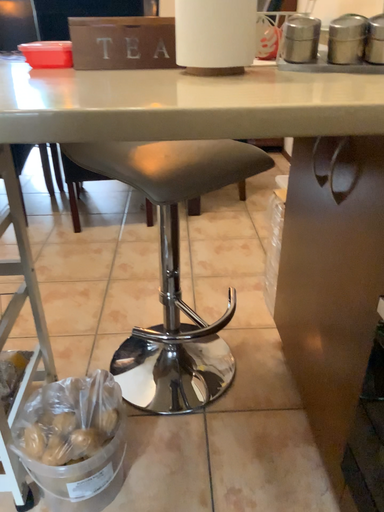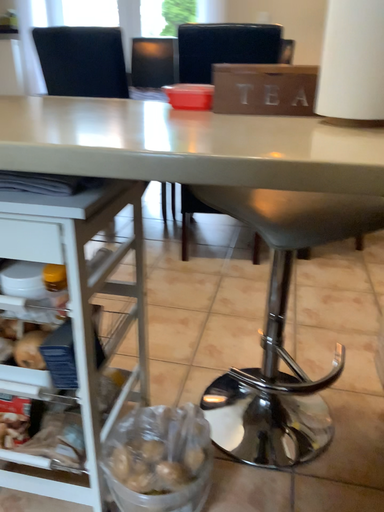
Question: How did the camera likely rotate when shooting the video?

Choices:
 (A) rotated left
 (B) rotated right

Answer: (A)